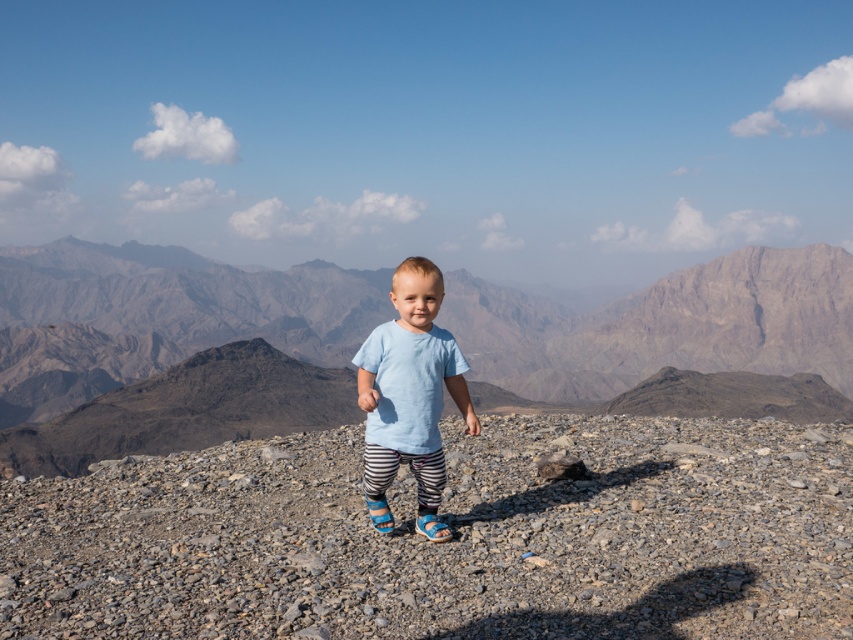
You are a photographer trying to capture the light blue cotton shirt at center and the gray gravel at center in the same frame. Based on their positions, which object is closer to the left side of the image?

The gray gravel at center is to the left of the light blue cotton shirt at center, so the gray gravel at center is closer to the left side of the image.

You are a photographer setting up a tripod to take a photo of the child in the scene. You need to place the tripod such that it is closer to the camera than both points mentioned. Which of the two points, point (521, 456) or point (357, 353), is closer to the camera and thus requires the tripod to be placed behind it to ensure it stays in front?

Point (521, 456) is closer to the camera than point (357, 353). Therefore, to keep the tripod in front of both points, it should be placed behind point (521, 456) since it is nearer to the camera.

The scene shows a child on a rocky landscape with mountains in the background. There is a point marked at coordinates [447,541]. What is located at this point?

The point marked at coordinates [447,541] indicates the location of gray gravel at center.